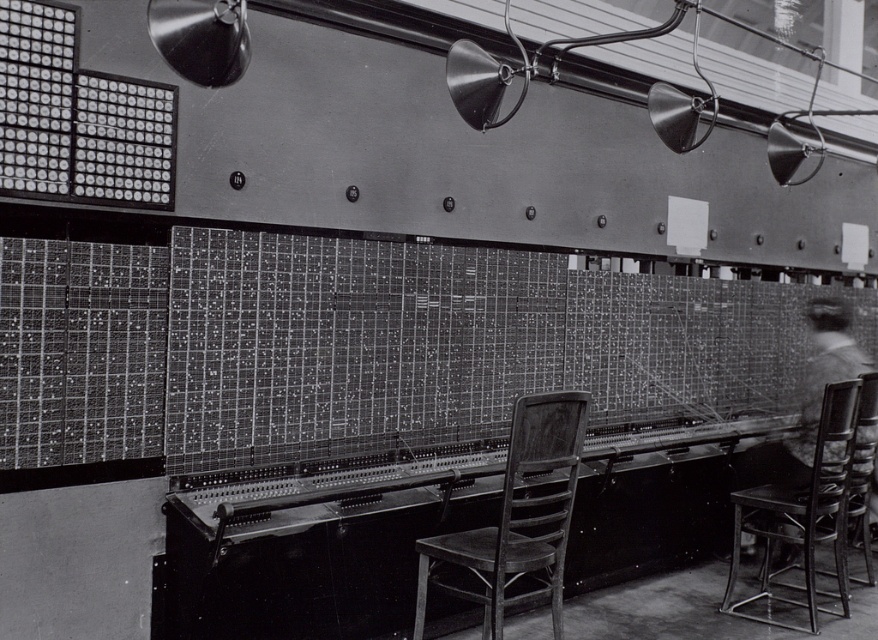
Measure the distance between wooden chair at center and wooden chair at right.

The distance of wooden chair at center from wooden chair at right is 5.86 feet.

Does wooden chair at center have a smaller size compared to wooden chair at right?

Yes, wooden chair at center is smaller than wooden chair at right.

Image resolution: width=878 pixels, height=640 pixels. What are the coordinates of `wooden chair at center` in the screenshot? It's located at (517, 516).